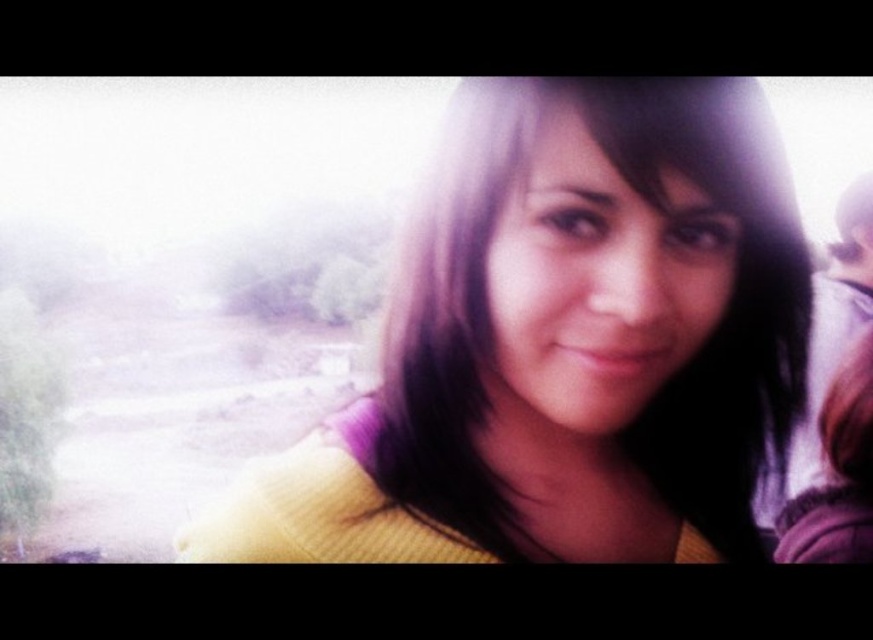
Consider the image. You are trying to decide which sweater to wear today. You have a yellow knitted sweater at center and a smooth purple sweater at right. Which one is wider?

The smooth purple sweater at right is wider than the yellow knitted sweater at center.

From the picture: You are a fashion stylist helping a client choose between the yellow knitted sweater at center and the smooth purple sweater at right. The client wants to know which one is smaller in size. Which one should you recommend?

The yellow knitted sweater at center has a smaller size compared to the smooth purple sweater at right, so you should recommend the yellow knitted sweater at center as the smaller option.